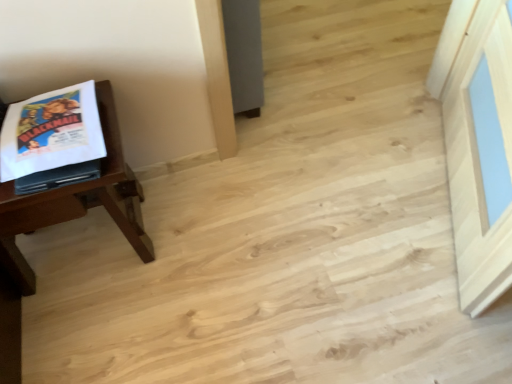
Where is `vacant space to the right of wooden table at left`? vacant space to the right of wooden table at left is located at coordinates (202, 236).